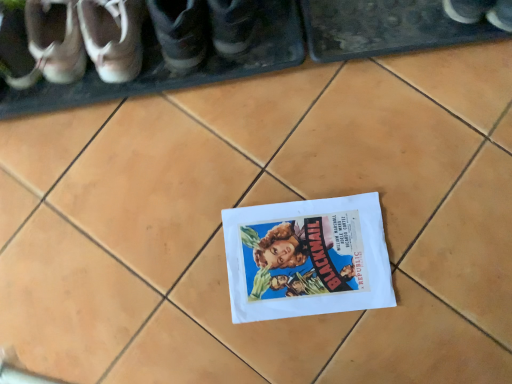
Question: From a real-world perspective, is matte brown shoe at upper left, marked as the third footwear in a left-to-right arrangement, under dark gray leather shoe at upper left, the 5th footwear from the left?

Choices:
 (A) no
 (B) yes

Answer: (B)

Question: Does matte brown shoe at upper left, the fourth footwear from the right, have a greater width compared to dark gray leather shoe at upper left, the 2th footwear from the right?

Choices:
 (A) no
 (B) yes

Answer: (A)

Question: Is matte brown shoe at upper left, marked as the third footwear in a left-to-right arrangement, shorter than dark gray leather shoe at upper left, the 2th footwear from the right?

Choices:
 (A) yes
 (B) no

Answer: (A)

Question: Is matte brown shoe at upper left, the fourth footwear from the right, outside of dark gray leather shoe at upper left, the 2th footwear from the right?

Choices:
 (A) no
 (B) yes

Answer: (B)

Question: Is dark gray leather shoe at upper left, the 2th footwear from the right, completely or partially inside matte brown shoe at upper left, marked as the third footwear in a left-to-right arrangement?

Choices:
 (A) yes
 (B) no

Answer: (B)

Question: Is matte brown shoe at upper left, the fourth footwear from the right, smaller than dark gray leather shoe at upper left, the 5th footwear from the left?

Choices:
 (A) no
 (B) yes

Answer: (B)

Question: Would you say matte white sneakers at upper left, arranged as the 3th footwear when viewed from the right, is part of matte black shoe at center, which is the sixth footwear in left-to-right order,'s contents?

Choices:
 (A) yes
 (B) no

Answer: (B)

Question: From the image's perspective, is matte black shoe at center, which is the sixth footwear in left-to-right order, under matte white sneakers at upper left, which is the fourth footwear from left to right?

Choices:
 (A) yes
 (B) no

Answer: (B)

Question: Considering the relative sizes of matte black shoe at center, which is the sixth footwear in left-to-right order, and matte white sneakers at upper left, which is the fourth footwear from left to right, in the image provided, is matte black shoe at center, which is the sixth footwear in left-to-right order, shorter than matte white sneakers at upper left, which is the fourth footwear from left to right,?

Choices:
 (A) yes
 (B) no

Answer: (B)

Question: From a real-world perspective, is matte black shoe at center, which is the sixth footwear in left-to-right order, positioned over matte white sneakers at upper left, which is the fourth footwear from left to right, based on gravity?

Choices:
 (A) no
 (B) yes

Answer: (B)

Question: Is matte black shoe at center, which is the sixth footwear in left-to-right order, to the right of matte white sneakers at upper left, arranged as the 3th footwear when viewed from the right, from the viewer's perspective?

Choices:
 (A) yes
 (B) no

Answer: (A)

Question: Is matte black shoe at center, the 1th footwear from the right, positioned before matte white sneakers at upper left, arranged as the 3th footwear when viewed from the right?

Choices:
 (A) no
 (B) yes

Answer: (B)

Question: Are white leather shoe at left, marked as the sixth footwear in a right-to-left arrangement, and matte black shoe at center, which is the sixth footwear in left-to-right order, beside each other?

Choices:
 (A) no
 (B) yes

Answer: (A)